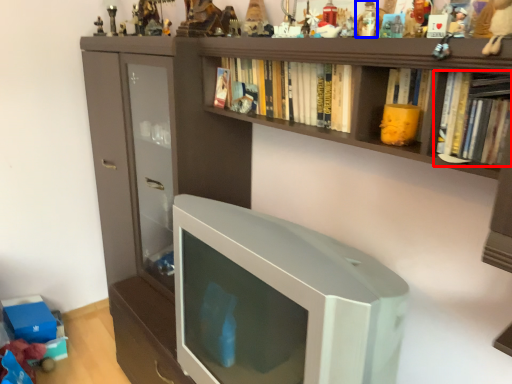
Question: Which of the following is the closest to the observer, book (highlighted by a red box) or toy (highlighted by a blue box)?

Choices:
 (A) book
 (B) toy

Answer: (A)